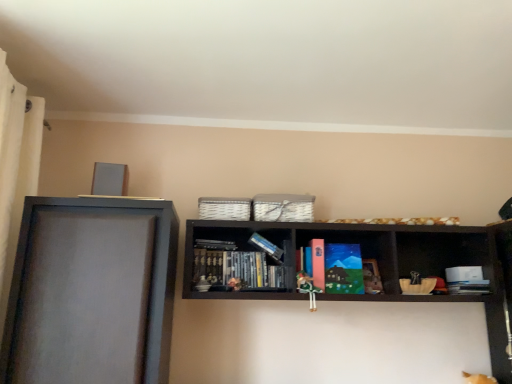
Question: Considering the relative sizes of wooden bookshelf at center, the 1th shelf positioned from the right, and green fabric doll at center in the image provided, is wooden bookshelf at center, the 1th shelf positioned from the right, wider than green fabric doll at center?

Choices:
 (A) yes
 (B) no

Answer: (A)

Question: From the image's perspective, would you say wooden bookshelf at center, the 1th shelf positioned from the right, is positioned over green fabric doll at center?

Choices:
 (A) yes
 (B) no

Answer: (A)

Question: Is green fabric doll at center surrounded by wooden bookshelf at center, which is the second shelf from left to right?

Choices:
 (A) no
 (B) yes

Answer: (B)

Question: Is wooden bookshelf at center, the 1th shelf positioned from the right, bigger than green fabric doll at center?

Choices:
 (A) yes
 (B) no

Answer: (A)

Question: Can you see wooden bookshelf at center, which is the second shelf from left to right, touching green fabric doll at center?

Choices:
 (A) no
 (B) yes

Answer: (A)

Question: Visually, is matte paperback book at center positioned to the left or to the right of green fabric doll at center?

Choices:
 (A) right
 (B) left

Answer: (A)

Question: In the image, is matte paperback book at center positioned in front of or behind green fabric doll at center?

Choices:
 (A) behind
 (B) front

Answer: (A)

Question: From the image's perspective, relative to green fabric doll at center, is matte paperback book at center above or below?

Choices:
 (A) above
 (B) below

Answer: (A)

Question: Is matte paperback book at center wider or thinner than green fabric doll at center?

Choices:
 (A) wide
 (B) thin

Answer: (B)

Question: From a real-world perspective, is matte gray frame at left, positioned as the 1th shelf in left-to-right order, above or below wooden bookshelf at center, the 1th shelf positioned from the right?

Choices:
 (A) below
 (B) above

Answer: (A)

Question: Looking at the image, does matte gray frame at left, positioned as the 1th shelf in left-to-right order, seem bigger or smaller compared to wooden bookshelf at center, the 1th shelf positioned from the right?

Choices:
 (A) big
 (B) small

Answer: (A)

Question: Based on their positions, is matte gray frame at left, the 2th shelf positioned from the right, located to the left or right of wooden bookshelf at center, the 1th shelf positioned from the right?

Choices:
 (A) left
 (B) right

Answer: (A)

Question: Considering the positions of point (123, 218) and point (306, 223), is point (123, 218) closer or farther from the camera than point (306, 223)?

Choices:
 (A) farther
 (B) closer

Answer: (B)

Question: Is point (454, 286) closer or farther from the camera than point (222, 228)?

Choices:
 (A) farther
 (B) closer

Answer: (B)

Question: Is hardcover book at center, marked as the 2th book in a left-to-right arrangement, inside the boundaries of wooden bookshelf at center, which is the second shelf from left to right, or outside?

Choices:
 (A) inside
 (B) outside

Answer: (A)